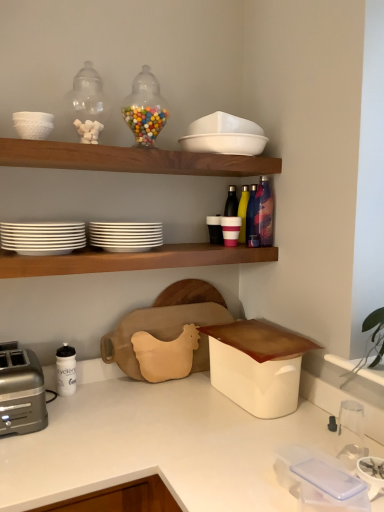
Question: Looking at the image, does metallic blue water bottle at upper right, the second bottle in the front-to-back sequence, seem bigger or smaller compared to yellow matte bottle at upper right, which ranks as the third bottle in front-to-back order?

Choices:
 (A) small
 (B) big

Answer: (A)

Question: Considering the positions of point (253, 202) and point (244, 238), is point (253, 202) closer or farther from the camera than point (244, 238)?

Choices:
 (A) farther
 (B) closer

Answer: (B)

Question: Estimate the real-world distances between objects in this image. Which object is farther from the yellow matte bottle at upper right, acting as the first bottle starting from the back?

Choices:
 (A) wooden shelf at upper center, acting as the first shelf starting from the top
 (B) green leafy plant at upper right
 (C) white glossy plates at upper left, the 6th tableware from the top
 (D) metallic multi-colored bottle at upper right, arranged as the third bottle when viewed from the back
 (E) matte black cup at center, the third tableware positioned from the top

Answer: (C)

Question: Which object is positioned farthest from the metallic multi-colored bottle at upper right, arranged as the third bottle when viewed from the back?

Choices:
 (A) translucent glass jar at upper center, the first tableware when ordered from top to bottom
 (B) white plastic container at lower right
 (C) white glossy plates at upper center, which is the third tableware from bottom to top
 (D) silver metallic toaster at lower left
 (E) white matte cup at center, the fourth tableware positioned from the bottom

Answer: (D)